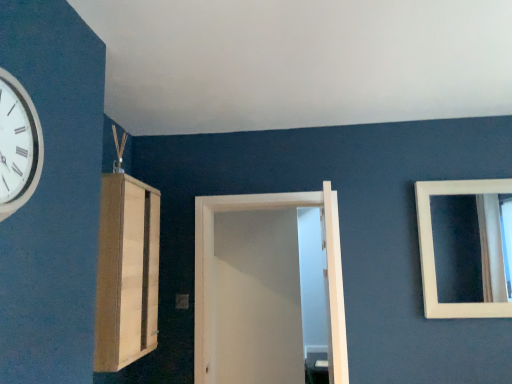
Question: Considering the relative sizes of light wood cabinet at left and white matte door at center in the image provided, is light wood cabinet at left smaller than white matte door at center?

Choices:
 (A) no
 (B) yes

Answer: (B)

Question: Are light wood cabinet at left and white matte door at center beside each other?

Choices:
 (A) no
 (B) yes

Answer: (A)

Question: From the image's perspective, is light wood cabinet at left above white matte door at center?

Choices:
 (A) yes
 (B) no

Answer: (A)

Question: Is light wood cabinet at left to the right of white matte door at center from the viewer's perspective?

Choices:
 (A) no
 (B) yes

Answer: (A)

Question: Is light wood cabinet at left behind white matte door at center?

Choices:
 (A) no
 (B) yes

Answer: (A)

Question: Can we say light wood cabinet at left lies outside white matte door at center?

Choices:
 (A) yes
 (B) no

Answer: (A)

Question: Does white glossy clock at upper left come behind white matte mirror at upper right?

Choices:
 (A) yes
 (B) no

Answer: (B)

Question: Can you confirm if white glossy clock at upper left is thinner than white matte mirror at upper right?

Choices:
 (A) yes
 (B) no

Answer: (B)

Question: From a real-world perspective, does white glossy clock at upper left sit lower than white matte mirror at upper right?

Choices:
 (A) yes
 (B) no

Answer: (B)

Question: Is white glossy clock at upper left turned away from white matte mirror at upper right?

Choices:
 (A) yes
 (B) no

Answer: (B)

Question: From a real-world perspective, is white glossy clock at upper left positioned over white matte mirror at upper right based on gravity?

Choices:
 (A) yes
 (B) no

Answer: (A)

Question: Considering the relative sizes of white glossy clock at upper left and white matte mirror at upper right in the image provided, is white glossy clock at upper left wider than white matte mirror at upper right?

Choices:
 (A) yes
 (B) no

Answer: (A)

Question: Considering the relative positions of white matte door at center and white glossy clock at upper left in the image provided, is white matte door at center to the right of white glossy clock at upper left from the viewer's perspective?

Choices:
 (A) yes
 (B) no

Answer: (A)